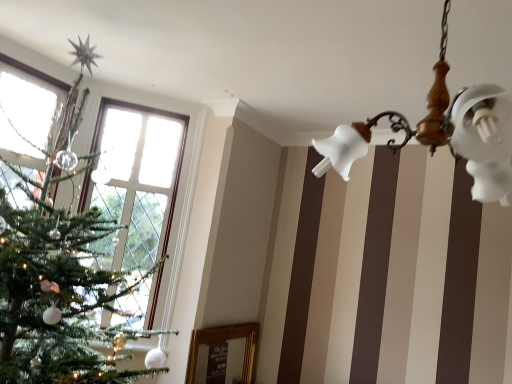
Question: Based on their sizes in the image, would you say clear glass window at left is bigger or smaller than white glass chandelier at upper right?

Choices:
 (A) big
 (B) small

Answer: (B)

Question: Does point (169, 117) appear closer or farther from the camera than point (476, 178)?

Choices:
 (A) closer
 (B) farther

Answer: (B)

Question: From their relative heights in the image, would you say clear glass window at left is taller or shorter than white glass chandelier at upper right?

Choices:
 (A) short
 (B) tall

Answer: (B)

Question: From the image's perspective, is white glass chandelier at upper right positioned above or below clear glass window at left?

Choices:
 (A) below
 (B) above

Answer: (B)

Question: Is point (437, 109) closer or farther from the camera than point (115, 160)?

Choices:
 (A) closer
 (B) farther

Answer: (A)

Question: In terms of size, does white glass chandelier at upper right appear bigger or smaller than clear glass window at left?

Choices:
 (A) small
 (B) big

Answer: (B)

Question: Looking at their shapes, would you say white glass chandelier at upper right is wider or thinner than clear glass window at left?

Choices:
 (A) wide
 (B) thin

Answer: (A)